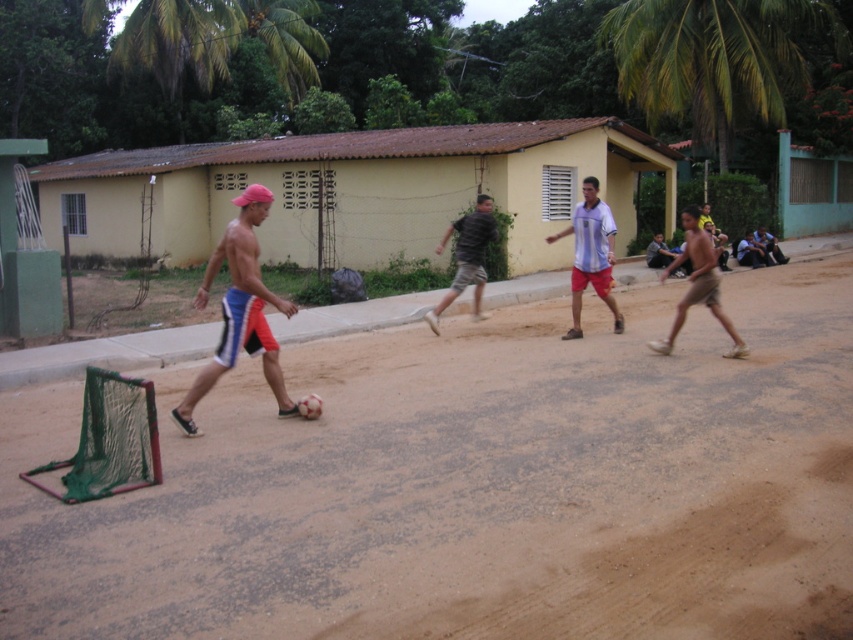
You are a photographer trying to capture a photo of the shiny blue shorts at center and the brown cotton shorts at right. Based on their positions, which one is closer to the camera?

The shiny blue shorts at center is located above the brown cotton shorts at right, so the shiny blue shorts at center is closer to the camera.

You are standing at the center of the soccer field and want to locate the yellow matte building at center. Which direction should you face to see it?

The yellow matte building at center is located at point coordinates [354,189], so you should face the direction of the coordinates [354,189] to see it.